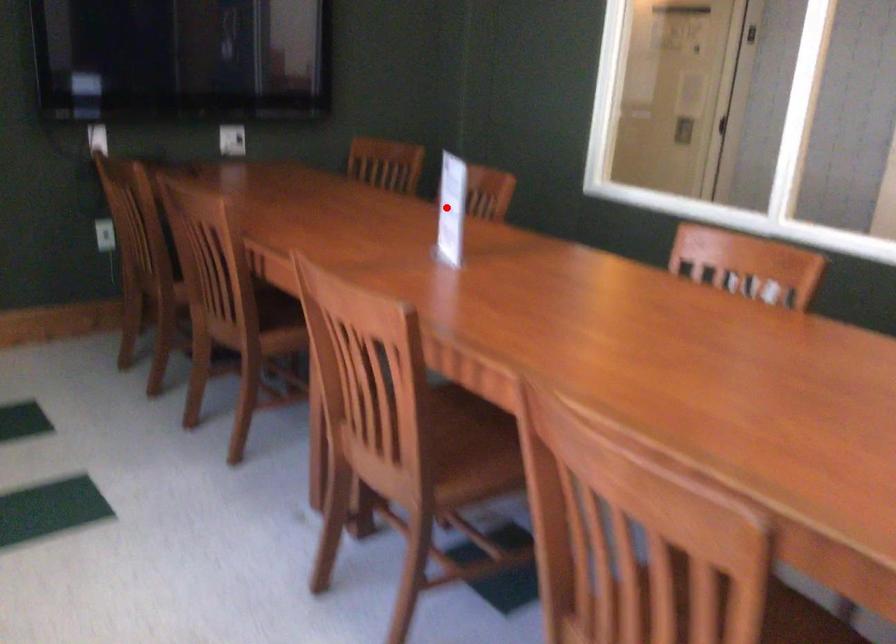
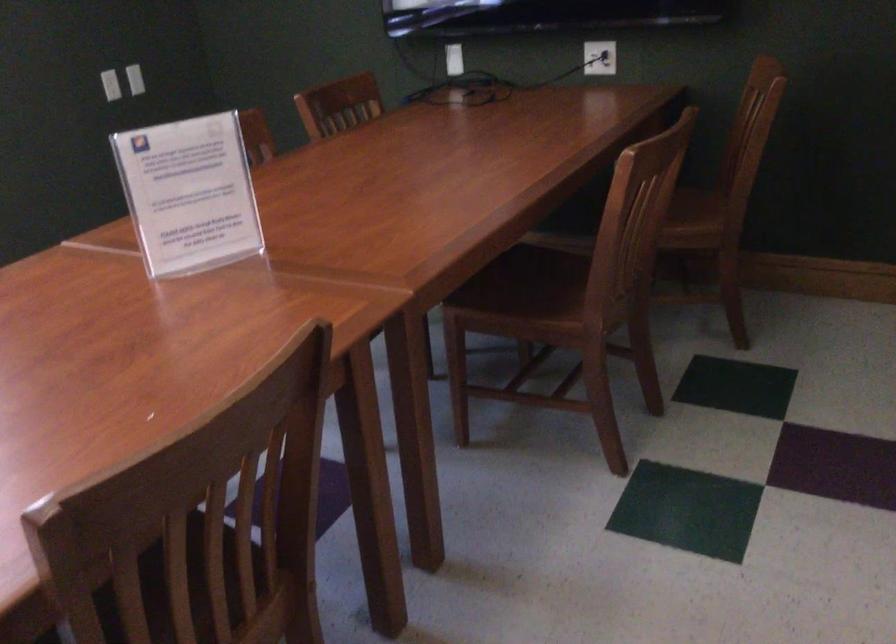
Question: I am providing you with two images of the same scene from different viewpoints. Image1 has a red point marked. In image2, the corresponding 3D location appears at what relative position? Reply with the corresponding letter.

Choices:
 (A) Closer
 (B) Farther

Answer: (A)